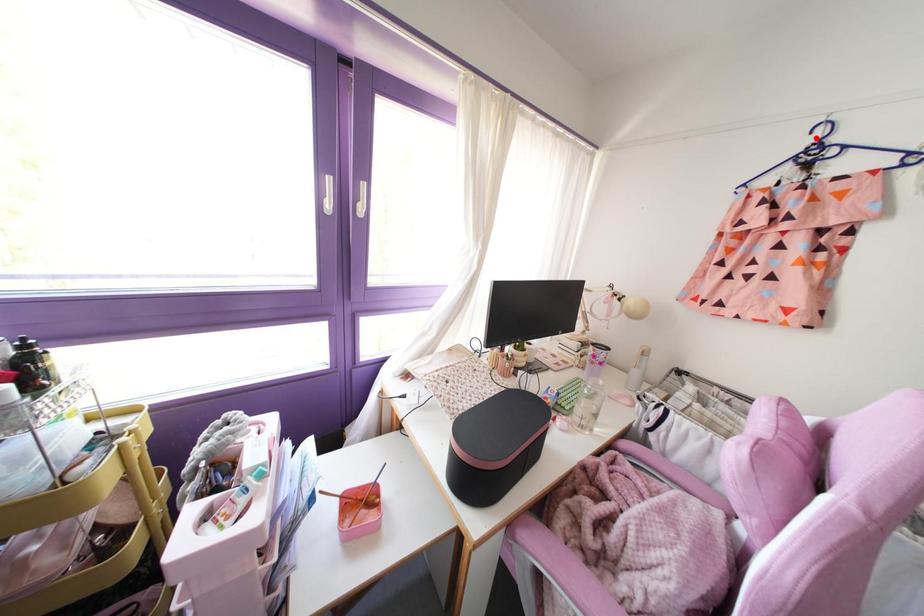
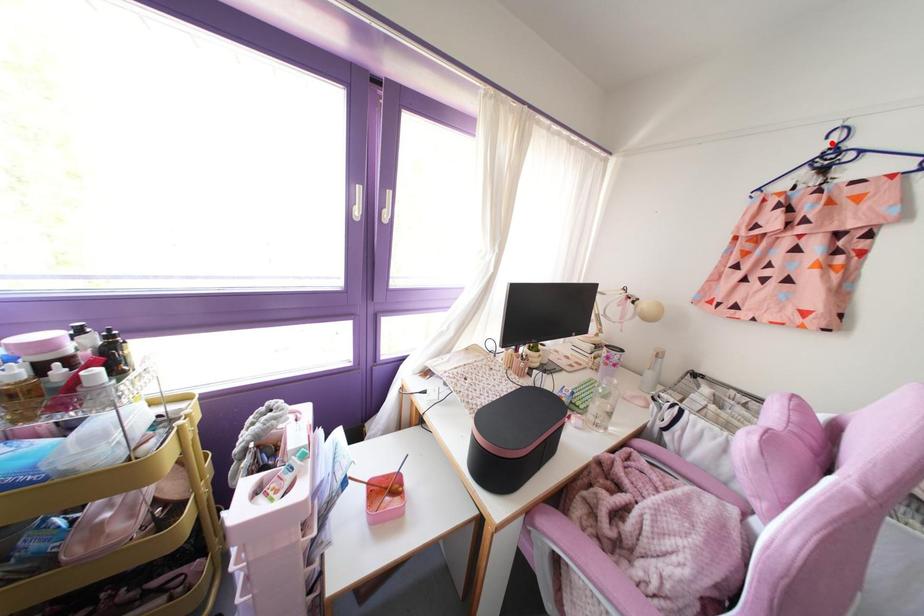
I am providing you with two images of the same scene from different viewpoints. A red point is marked on the first image and another point is marked on the second image. Do the highlighted points in image1 and image2 indicate the same real-world spot?

Yes